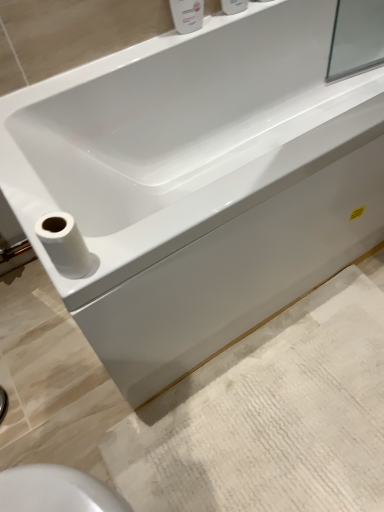
Question: Does white glossy soap dispenser at upper center, the first toiletry when ordered from left to right, have a greater width compared to white textured bath mat at lower right?

Choices:
 (A) yes
 (B) no

Answer: (B)

Question: Can white textured bath mat at lower right be found inside white glossy soap dispenser at upper center, which is the 2th toiletry from right to left?

Choices:
 (A) yes
 (B) no

Answer: (B)

Question: Considering the relative sizes of white glossy soap dispenser at upper center, which is the 2th toiletry from right to left, and white textured bath mat at lower right in the image provided, is white glossy soap dispenser at upper center, which is the 2th toiletry from right to left, taller than white textured bath mat at lower right?

Choices:
 (A) no
 (B) yes

Answer: (B)

Question: Considering the relative positions of white glossy soap dispenser at upper center, the first toiletry when ordered from left to right, and white textured bath mat at lower right in the image provided, is white glossy soap dispenser at upper center, the first toiletry when ordered from left to right, in front of white textured bath mat at lower right?

Choices:
 (A) yes
 (B) no

Answer: (B)

Question: Does white glossy soap dispenser at upper center, the first toiletry when ordered from left to right, have a larger size compared to white textured bath mat at lower right?

Choices:
 (A) no
 (B) yes

Answer: (A)

Question: From the image's perspective, is white glossy soap dispenser at upper center, the first toiletry when ordered from left to right, located beneath white textured bath mat at lower right?

Choices:
 (A) yes
 (B) no

Answer: (B)

Question: From the image's perspective, is white glossy soap dispenser at upper center, which is the 2th toiletry from right to left, located above white matte toilet paper at lower left?

Choices:
 (A) yes
 (B) no

Answer: (A)

Question: Is white glossy soap dispenser at upper center, which is the 2th toiletry from right to left, at the right side of white matte toilet paper at lower left?

Choices:
 (A) no
 (B) yes

Answer: (B)

Question: Considering the relative sizes of white glossy soap dispenser at upper center, which is the 2th toiletry from right to left, and white matte toilet paper at lower left in the image provided, is white glossy soap dispenser at upper center, which is the 2th toiletry from right to left, bigger than white matte toilet paper at lower left?

Choices:
 (A) yes
 (B) no

Answer: (A)

Question: Considering the relative positions of white glossy soap dispenser at upper center, which is the 2th toiletry from right to left, and white matte toilet paper at lower left in the image provided, is white glossy soap dispenser at upper center, which is the 2th toiletry from right to left, in front of white matte toilet paper at lower left?

Choices:
 (A) no
 (B) yes

Answer: (A)

Question: Considering the relative sizes of white glossy soap dispenser at upper center, which is the 2th toiletry from right to left, and white matte toilet paper at lower left in the image provided, is white glossy soap dispenser at upper center, which is the 2th toiletry from right to left, taller than white matte toilet paper at lower left?

Choices:
 (A) yes
 (B) no

Answer: (A)

Question: Does white glossy soap dispenser at upper center, which is the 2th toiletry from right to left, lie behind white matte toilet paper at lower left?

Choices:
 (A) no
 (B) yes

Answer: (B)

Question: Does white glossy bottle at upper center, which appears as the 2th toiletry when viewed from the left, appear on the left side of white matte toilet paper at lower left?

Choices:
 (A) no
 (B) yes

Answer: (A)